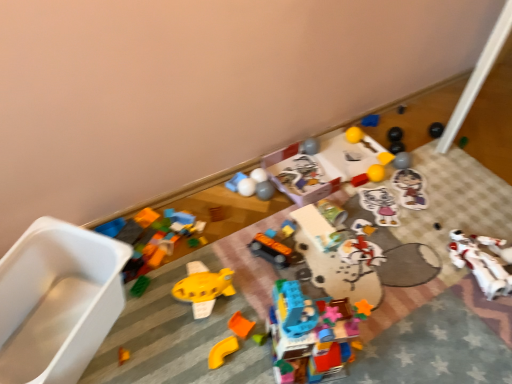
The height and width of the screenshot is (384, 512). Identify the location of free space to the back side of yellow matte toy boat at center, which ranks as the 16th toy in right-to-left order. (229, 254).